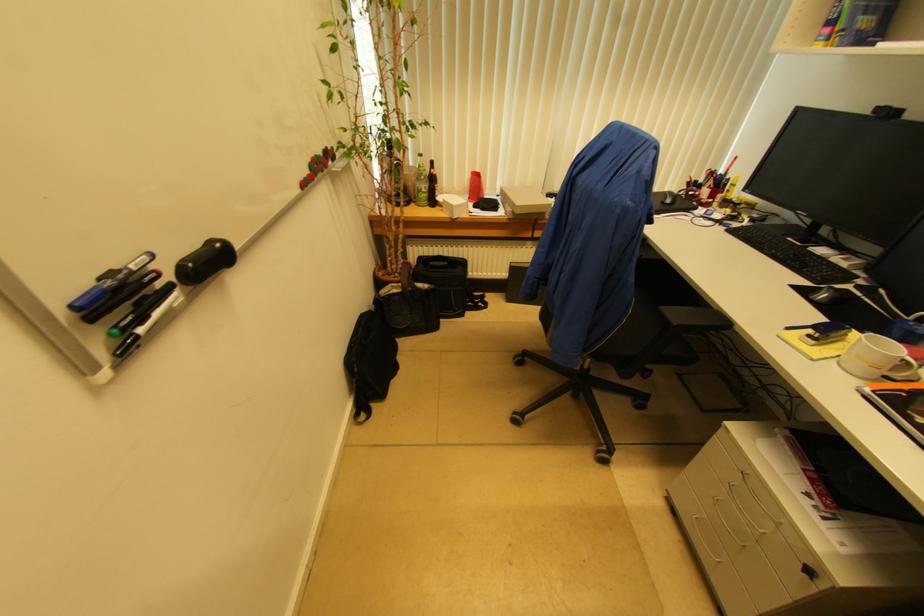
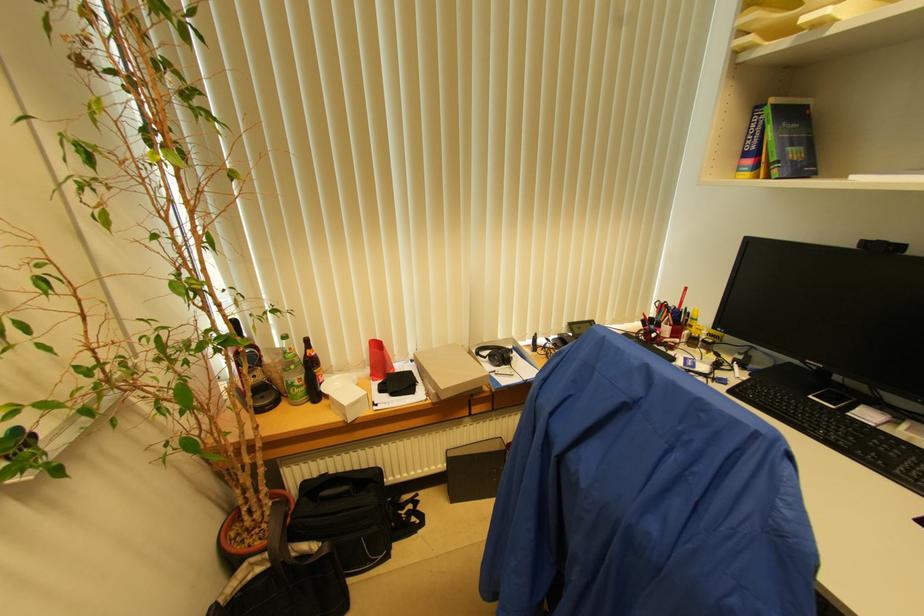
Find the pixel in the second image that matches pixel 500 196 in the first image.

(415, 361)